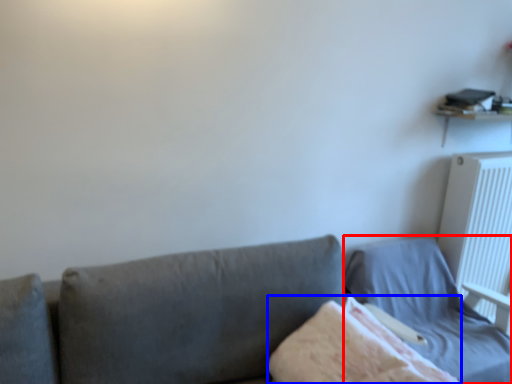
Question: Which object appears farthest to the camera in this image, bed (highlighted by a red box) or blanket (highlighted by a blue box)?

Choices:
 (A) bed
 (B) blanket

Answer: (A)